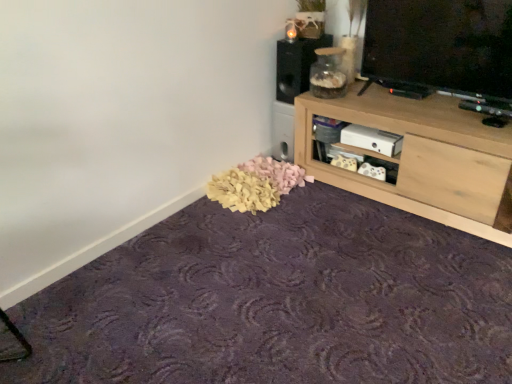
Question: Are light wood shelf at upper right and purple textured carpet at lower center making contact?

Choices:
 (A) no
 (B) yes

Answer: (A)

Question: Could you tell me if light wood shelf at upper right is turned towards purple textured carpet at lower center?

Choices:
 (A) no
 (B) yes

Answer: (B)

Question: Is light wood shelf at upper right thinner than purple textured carpet at lower center?

Choices:
 (A) yes
 (B) no

Answer: (A)

Question: Does light wood shelf at upper right come behind purple textured carpet at lower center?

Choices:
 (A) no
 (B) yes

Answer: (B)

Question: Is light wood shelf at upper right positioned in front of purple textured carpet at lower center?

Choices:
 (A) no
 (B) yes

Answer: (A)

Question: From a real-world perspective, is light wood shelf at upper right physically above purple textured carpet at lower center?

Choices:
 (A) no
 (B) yes

Answer: (B)

Question: Does light wood shelf at upper right have a greater width compared to transparent glass jar at upper right?

Choices:
 (A) no
 (B) yes

Answer: (B)

Question: Does light wood shelf at upper right appear on the left side of transparent glass jar at upper right?

Choices:
 (A) no
 (B) yes

Answer: (A)

Question: From a real-world perspective, is light wood shelf at upper right beneath transparent glass jar at upper right?

Choices:
 (A) no
 (B) yes

Answer: (B)

Question: Would you consider light wood shelf at upper right to be distant from transparent glass jar at upper right?

Choices:
 (A) no
 (B) yes

Answer: (A)

Question: From the image's perspective, does light wood shelf at upper right appear lower than transparent glass jar at upper right?

Choices:
 (A) yes
 (B) no

Answer: (A)

Question: Considering the relative sizes of light wood shelf at upper right and transparent glass jar at upper right in the image provided, is light wood shelf at upper right bigger than transparent glass jar at upper right?

Choices:
 (A) yes
 (B) no

Answer: (A)

Question: Can you confirm if purple textured carpet at lower center is bigger than black matte speaker at upper center?

Choices:
 (A) no
 (B) yes

Answer: (B)